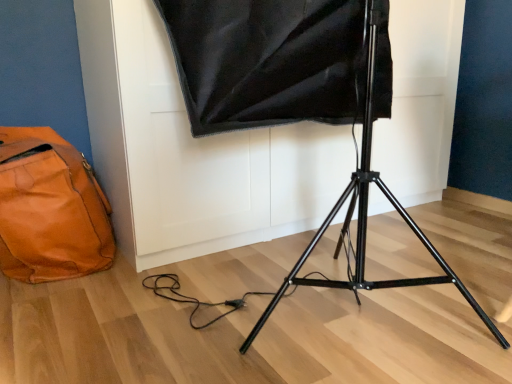
Question: Is the surface of black matte tripod at center in direct contact with orange leather bag at lower left?

Choices:
 (A) yes
 (B) no

Answer: (B)

Question: Does black matte tripod at center lie behind orange leather bag at lower left?

Choices:
 (A) no
 (B) yes

Answer: (A)

Question: Is black matte tripod at center facing away from orange leather bag at lower left?

Choices:
 (A) yes
 (B) no

Answer: (B)

Question: Does black matte tripod at center have a larger size compared to orange leather bag at lower left?

Choices:
 (A) no
 (B) yes

Answer: (B)

Question: Would you say orange leather bag at lower left is part of black matte tripod at center's contents?

Choices:
 (A) no
 (B) yes

Answer: (A)

Question: Can we say black matte tripod at center lies outside orange leather bag at lower left?

Choices:
 (A) yes
 (B) no

Answer: (A)

Question: Can you confirm if orange leather bag at lower left is taller than black matte tripod at center?

Choices:
 (A) no
 (B) yes

Answer: (A)

Question: Considering the relative sizes of orange leather bag at lower left and black matte tripod at center in the image provided, is orange leather bag at lower left smaller than black matte tripod at center?

Choices:
 (A) yes
 (B) no

Answer: (A)

Question: Is orange leather bag at lower left bigger than black matte tripod at center?

Choices:
 (A) no
 (B) yes

Answer: (A)

Question: Considering the relative sizes of orange leather bag at lower left and black matte tripod at center in the image provided, is orange leather bag at lower left shorter than black matte tripod at center?

Choices:
 (A) no
 (B) yes

Answer: (B)

Question: Is orange leather bag at lower left in front of black matte tripod at center?

Choices:
 (A) no
 (B) yes

Answer: (A)

Question: Is orange leather bag at lower left to the left of black matte tripod at center from the viewer's perspective?

Choices:
 (A) no
 (B) yes

Answer: (B)

Question: Choose the correct answer: Is orange leather bag at lower left inside black matte tripod at center or outside it?

Choices:
 (A) inside
 (B) outside

Answer: (B)